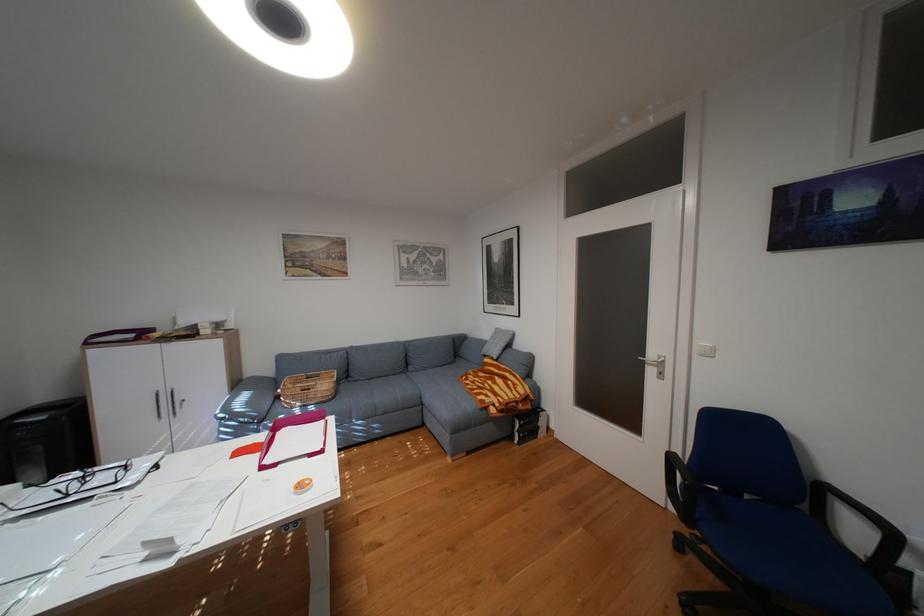
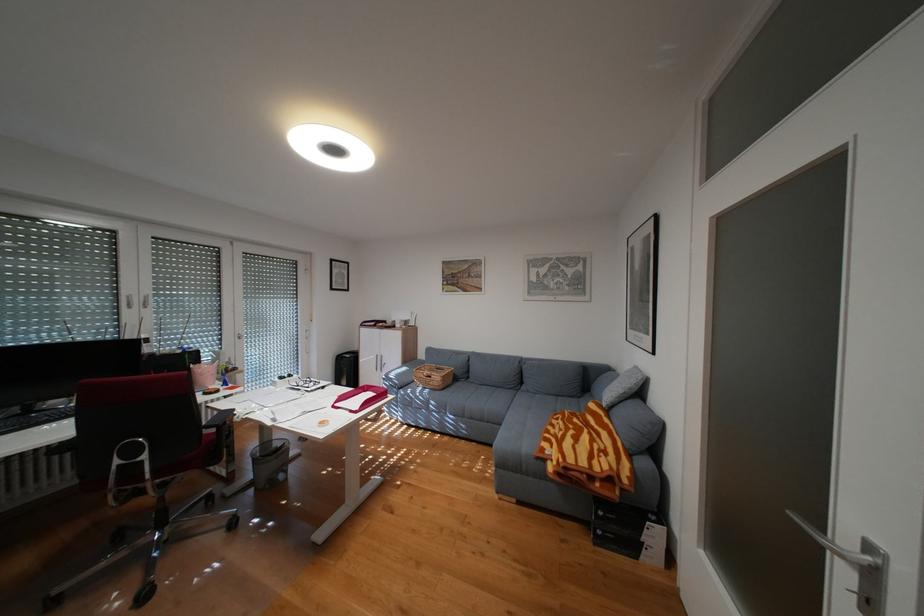
In the second image, find the point that corresponds to point 274,467 in the first image.

(346, 406)